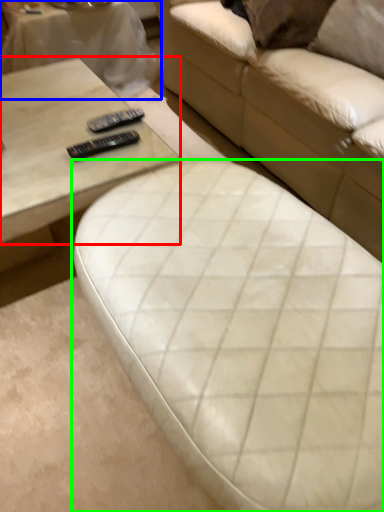
Question: Considering the real-world distances, which object is farthest from coffee table (highlighted by a red box)? table (highlighted by a blue box) or studio couch (highlighted by a green box)?

Choices:
 (A) table
 (B) studio couch

Answer: (A)